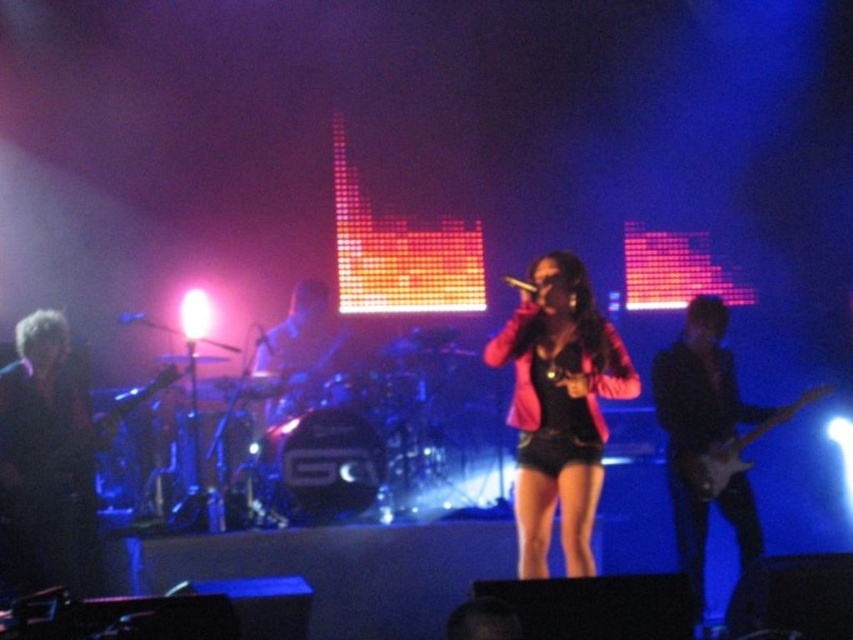
Question: Can you confirm if pink matte jacket at center is positioned below glossy electric guitar at right?

Choices:
 (A) no
 (B) yes

Answer: (A)

Question: Which of the following is the closest to the observer?

Choices:
 (A) 270,342
 (B) 517,280
 (C) 732,452
 (D) 45,465

Answer: (B)

Question: Which point is farther to the camera?

Choices:
 (A) black matte microphone at left
 (B) metallic silver microphone at center
 (C) glossy electric guitar at right
 (D) blue glossy microphone at center

Answer: (B)

Question: Does black matte microphone at center appear under metallic silver microphone at center?

Choices:
 (A) no
 (B) yes

Answer: (A)

Question: Which of the following is the farthest from the observer?

Choices:
 (A) pos(15,358)
 (B) pos(535,292)
 (C) pos(271,353)
 (D) pos(50,476)

Answer: (C)

Question: Is glossy electric guitar at right above black matte microphone at left?

Choices:
 (A) no
 (B) yes

Answer: (A)